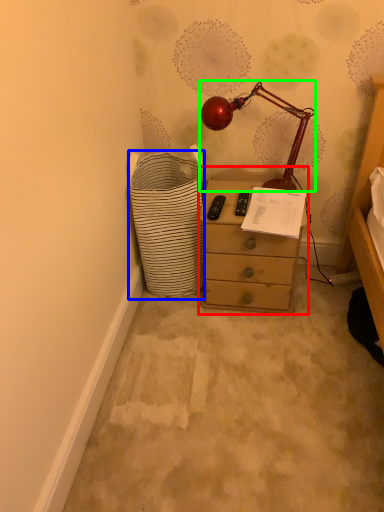
Question: Based on their relative distances, which object is nearer to chest of drawers (highlighted by a red box)? Choose from shopping basket (highlighted by a blue box) and lamp (highlighted by a green box).

Choices:
 (A) shopping basket
 (B) lamp

Answer: (A)